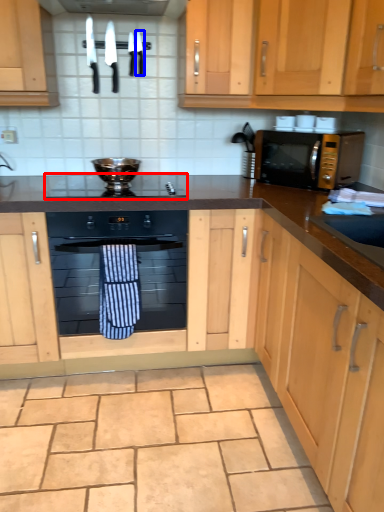
Question: Which point is closer to the camera, gas stove (highlighted by a red box) or knife (highlighted by a blue box)?

Choices:
 (A) gas stove
 (B) knife

Answer: (A)